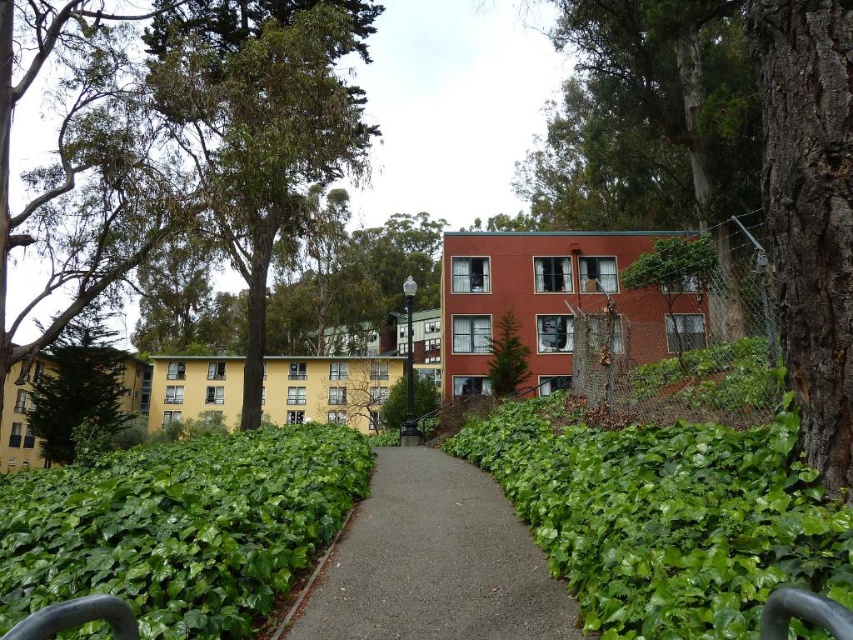
You are standing at the entrance of the pathway and want to reach the green leafy hedge at center. Based on the coordinates provided, in which direction should you walk along the path to reach it?

The green leafy hedge at center is located at point coordinates, so you should walk forward along the path towards the center to reach it.

You are standing at the starting point of the pathway in this outdoor scene. There are two points marked on the path. The first point is at coordinates point (x=566, y=532) and the second is at point (x=119, y=490). If you want to reach the point that is closer to you, which coordinates should you head towards?

You should head towards point (x=566, y=532) because it is closer to the camera than point (x=119, y=490).